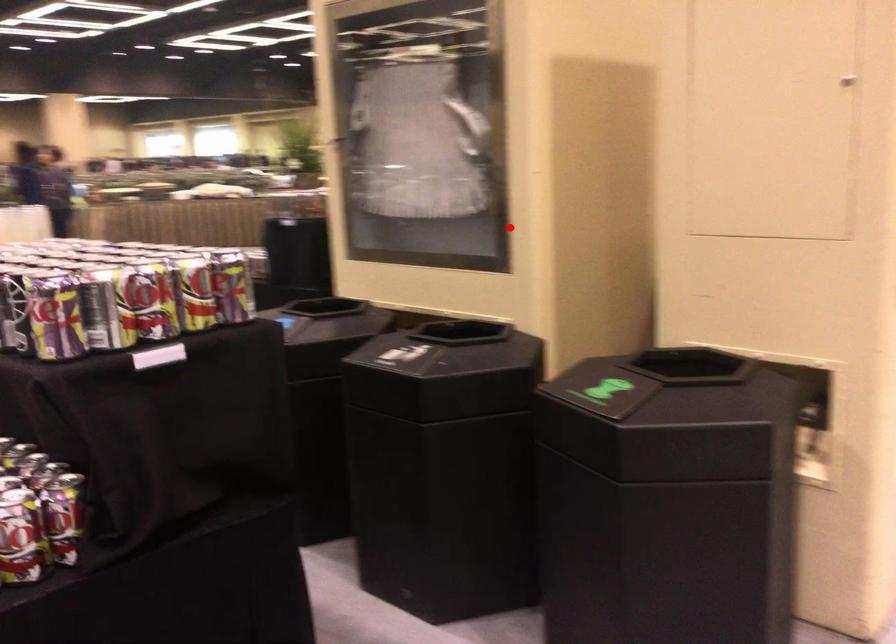
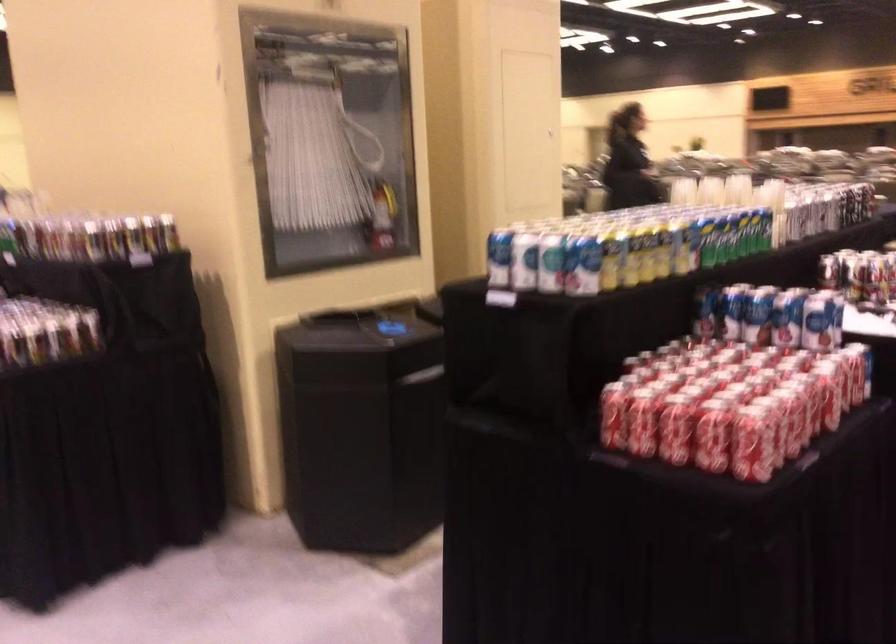
In the second image, find the point that corresponds to the highlighted location in the first image.

(382, 216)